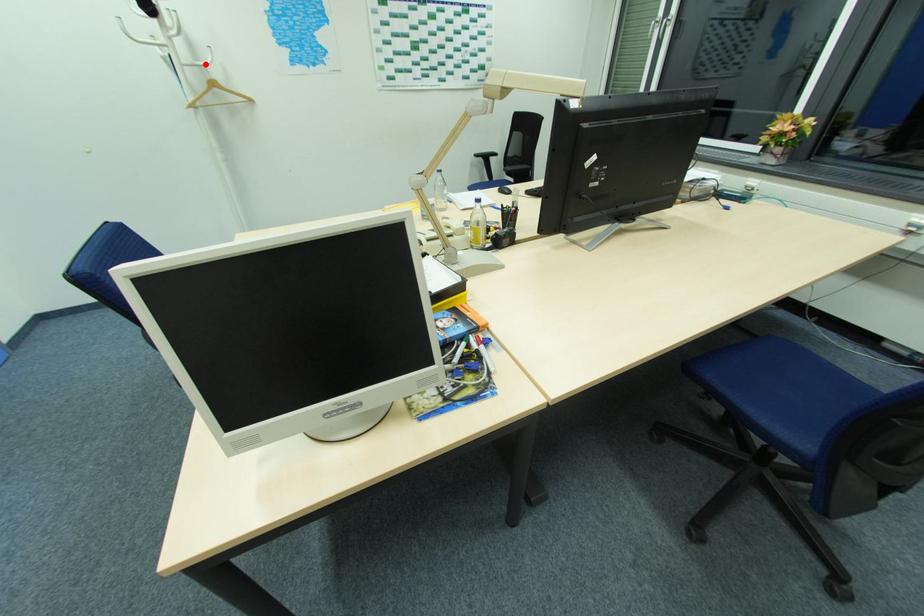
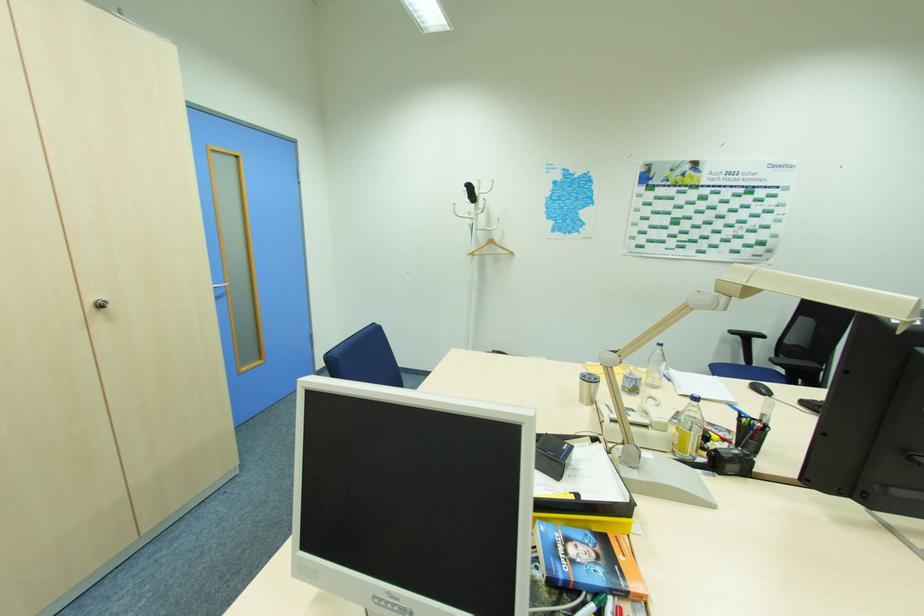
Question: I am providing you with two images of the same scene from different viewpoints. In image1, a red point is highlighted. Considering the same 3D point in image2, which of the following is correct?

Choices:
 (A) It is closer
 (B) It is farther

Answer: (A)